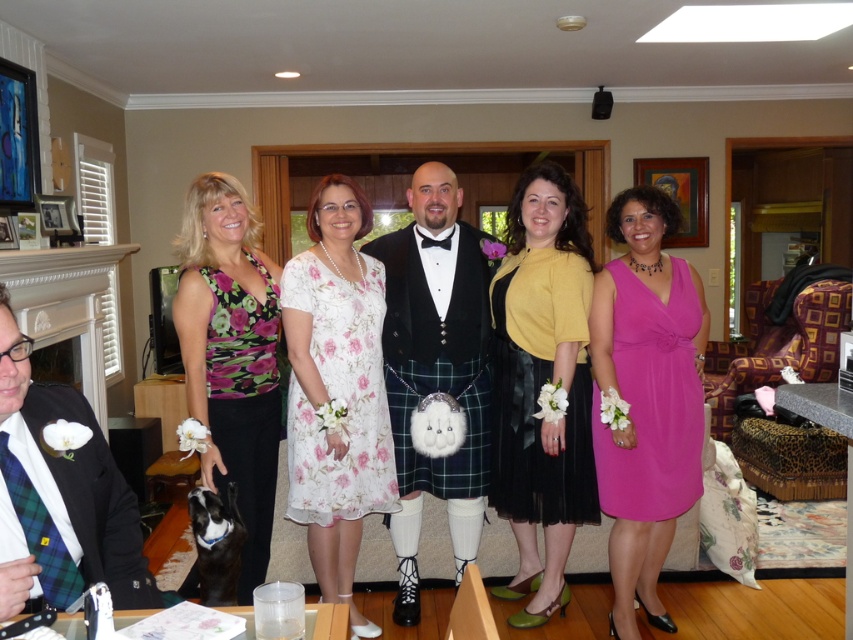
Describe the element at coordinates (339, 396) in the screenshot. I see `floral chiffon dress at center` at that location.

Who is higher up, floral chiffon dress at center or green plaid kilt at center?

Positioned higher is floral chiffon dress at center.

Who is more distant from viewer, (300, 392) or (392, 374)?

Point (392, 374)

At what (x,y) coordinates should I click in order to perform the action: click on floral chiffon dress at center. Please return your answer as a coordinate pair (x, y). The height and width of the screenshot is (640, 853). Looking at the image, I should click on (339, 396).

Does yellow satin dress at center have a greater width compared to floral chiffon dress at center?

No.

Is yellow satin dress at center positioned behind floral chiffon dress at center?

Yes, it is.

Is point (582, 404) farther from viewer compared to point (328, 268)?

Yes, it is.

Identify the location of yellow satin dress at center. The image size is (853, 640). (541, 385).

Is floral print dress at center smaller than floral chiffon dress at center?

Actually, floral print dress at center might be larger than floral chiffon dress at center.

Which is behind, point (276, 285) or point (318, 465)?

The point (276, 285) is behind.

In the scene shown: Who is more distant from viewer, (241, 326) or (302, 465)?

Point (302, 465)

You are a GUI agent. You are given a task and a screenshot of the screen. Output one action in this format:
    pyautogui.click(x=<x>, y=<y>)
    Task: Click on the floral print dress at center
    Image resolution: width=853 pixels, height=640 pixels.
    Given the screenshot: What is the action you would take?
    click(x=231, y=355)